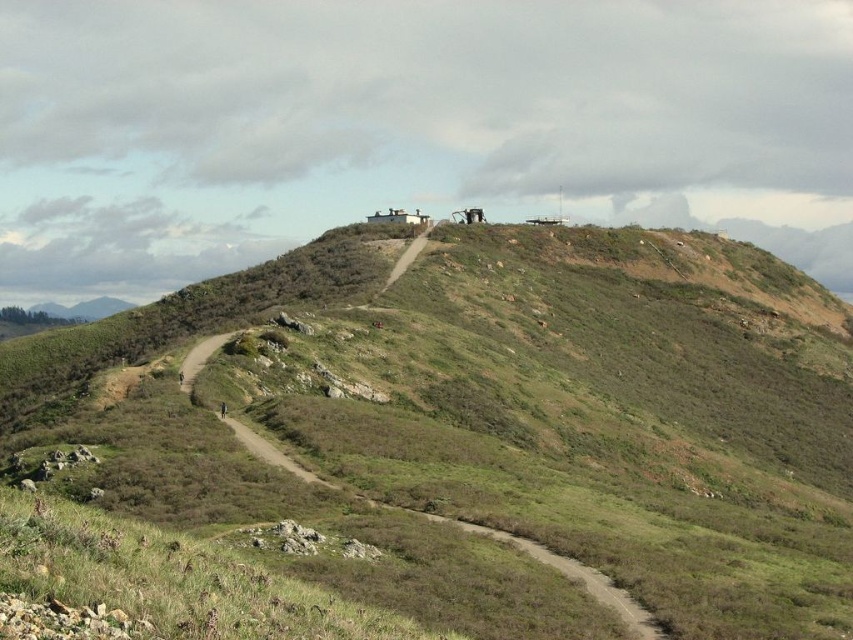
You are a hiker carrying a heavy backpack and want to reach the lookout point at the top of the green grassy hill at upper center. You notice the brown dirt trail at center. Considering the distance between them, can you estimate if taking the trail will save you time compared to going directly up the hill?

The green grassy hill at upper center is 68.20 meters away from the brown dirt trail at center. Taking the trail might save time as trails are usually easier to navigate than going directly up the hill through uneven terrain, but the total distance to the lookout point via the trail would need to be considered for an accurate time estimate.

You are a hiker standing at the starting point of the dirt path in the foreground. You want to reach the small structure on the hilltop. According to the map, there is a green grassy hill at upper center marked by point [503,406]. Which direction should you head towards from your current position to reach the structure efficiently?

You should head towards the green grassy hill at upper center marked by point [503,406] since it is the most direct path leading up to the hilltop where the structure is located.